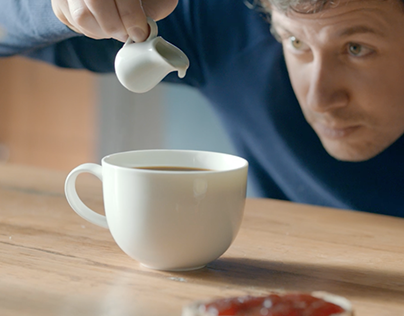
This screenshot has width=404, height=316. I want to click on brown liquid in teacup, so click(173, 168).